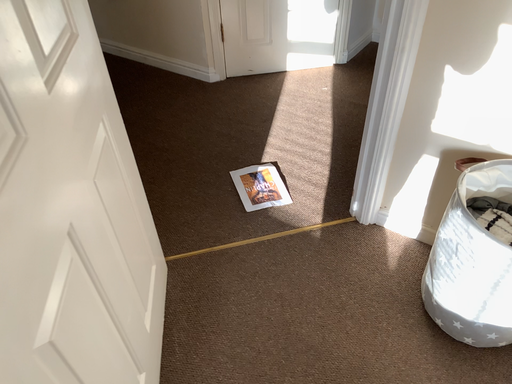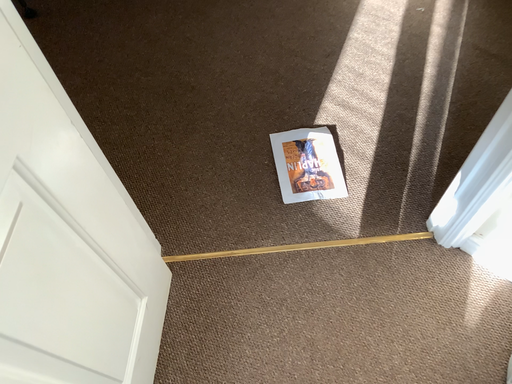
Question: Which way did the camera rotate in the video?

Choices:
 (A) rotated left
 (B) rotated right

Answer: (A)